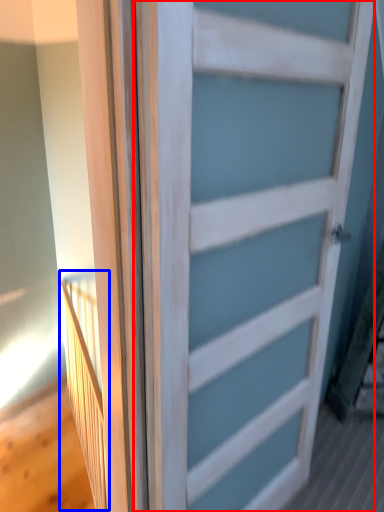
Question: Which of the following is the farthest to the observer, door (highlighted by a red box) or elevator (highlighted by a blue box)?

Choices:
 (A) door
 (B) elevator

Answer: (B)